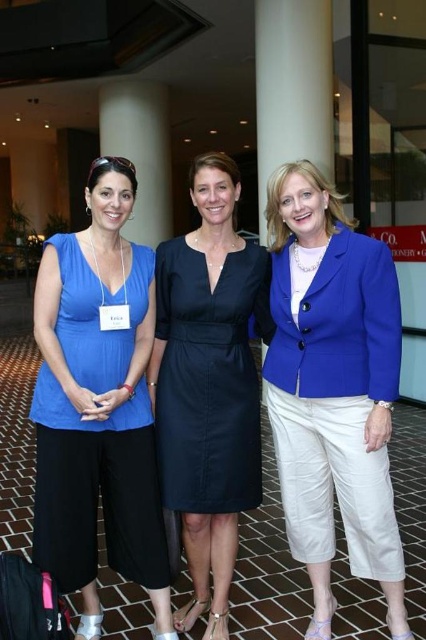
The image size is (426, 640). In order to click on matte blue top at center in this screenshot , I will do `click(97, 404)`.

Which is more to the right, matte blue top at center or white glossy pillar at upper center?

Positioned to the right is matte blue top at center.

Between point (48, 244) and point (152, 218), which one is positioned behind?

Point (152, 218)

Find the location of a particular element. matte blue top at center is located at coordinates [x=97, y=404].

Based on the photo, how distant is navy satin dress at center from white glossy pillar at upper center?

navy satin dress at center and white glossy pillar at upper center are 6.80 meters apart from each other.

Can you confirm if navy satin dress at center is bigger than white glossy pillar at upper center?

Incorrect, navy satin dress at center is not larger than white glossy pillar at upper center.

Which is behind, point (215, 452) or point (126, 134)?

Positioned behind is point (126, 134).

Identify the location of navy satin dress at center. The width and height of the screenshot is (426, 640). (210, 378).

Measure the distance between point (x=365, y=524) and camera.

Point (x=365, y=524) is 7.14 feet away from camera.

Can you confirm if matte blue blazer at center is positioned to the left of matte blue top at center?

No, matte blue blazer at center is not to the left of matte blue top at center.

Describe the element at coordinates (333, 388) in the screenshot. This screenshot has height=640, width=426. I see `matte blue blazer at center` at that location.

Find the location of a particular element. The height and width of the screenshot is (640, 426). matte blue blazer at center is located at coordinates (333, 388).